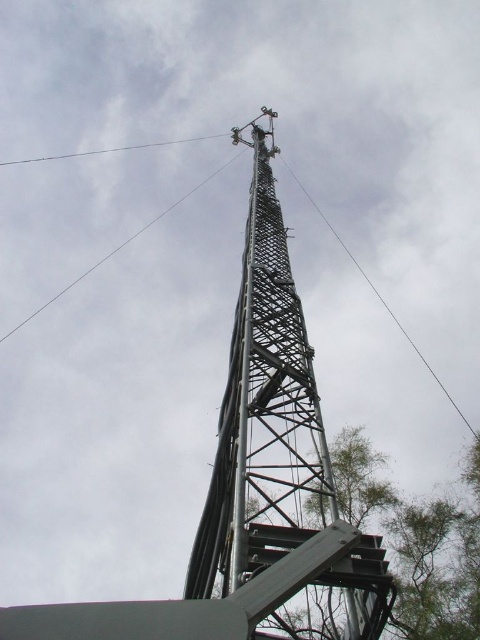
You are an engineer inspecting the structure of the metallic lattice tower at center and the smooth wire at upper center. Based on their heights, which one do you think is more likely to be affected by strong winds?

The metallic lattice tower at center has a greater height compared to the smooth wire at upper center, so it is more likely to be affected by strong winds because taller structures experience higher wind forces.

You are standing at the base of the tower and looking upwards. You notice two points marked on the tower. The first point is at coordinates point (261, 472) and the second point is at point (117, 150). Which point is closer to your viewpoint?

Point (261, 472) is in front of point (117, 150), so the first point is closer to your viewpoint.